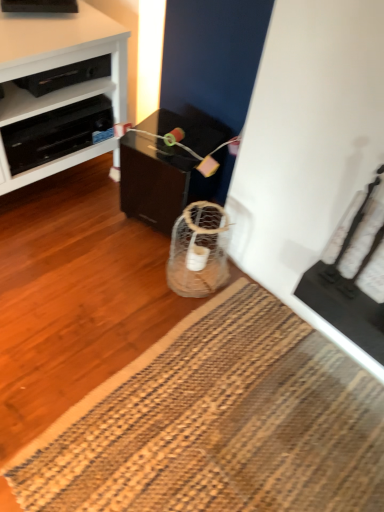
Question: Considering the relative positions of black plastic shelf at upper left and natural fiber mat at lower center in the image provided, is black plastic shelf at upper left to the right of natural fiber mat at lower center from the viewer's perspective?

Choices:
 (A) yes
 (B) no

Answer: (B)

Question: Does black plastic shelf at upper left come behind natural fiber mat at lower center?

Choices:
 (A) no
 (B) yes

Answer: (B)

Question: Is there a large distance between black plastic shelf at upper left and natural fiber mat at lower center?

Choices:
 (A) yes
 (B) no

Answer: (A)

Question: Is natural fiber mat at lower center located within black plastic shelf at upper left?

Choices:
 (A) no
 (B) yes

Answer: (A)

Question: Is black plastic shelf at upper left positioned in front of natural fiber mat at lower center?

Choices:
 (A) no
 (B) yes

Answer: (A)

Question: Based on their sizes in the image, would you say white glossy cabinet at left is bigger or smaller than black plastic drawer at upper left?

Choices:
 (A) big
 (B) small

Answer: (A)

Question: Looking at their shapes, would you say white glossy cabinet at left is wider or thinner than black plastic drawer at upper left?

Choices:
 (A) thin
 (B) wide

Answer: (B)

Question: From a real-world perspective, is white glossy cabinet at left positioned above or below black plastic drawer at upper left?

Choices:
 (A) below
 (B) above

Answer: (B)

Question: Is white glossy cabinet at left inside or outside of black plastic drawer at upper left?

Choices:
 (A) inside
 (B) outside

Answer: (B)

Question: Considering the relative positions of black plastic drawer at upper left and white glossy cabinet at left in the image provided, is black plastic drawer at upper left to the left or to the right of white glossy cabinet at left?

Choices:
 (A) left
 (B) right

Answer: (B)

Question: Is black plastic drawer at upper left inside the boundaries of white glossy cabinet at left, or outside?

Choices:
 (A) outside
 (B) inside

Answer: (B)

Question: From a real-world perspective, is black plastic drawer at upper left above or below white glossy cabinet at left?

Choices:
 (A) below
 (B) above

Answer: (A)

Question: Considering the positions of black plastic drawer at upper left and white glossy cabinet at left in the image, is black plastic drawer at upper left taller or shorter than white glossy cabinet at left?

Choices:
 (A) short
 (B) tall

Answer: (A)

Question: Is point (244, 505) positioned closer to the camera than point (13, 82)?

Choices:
 (A) farther
 (B) closer

Answer: (B)

Question: Considering the relative positions of natural fiber mat at lower center and black plastic shelf at upper left in the image provided, is natural fiber mat at lower center to the left or to the right of black plastic shelf at upper left?

Choices:
 (A) right
 (B) left

Answer: (A)